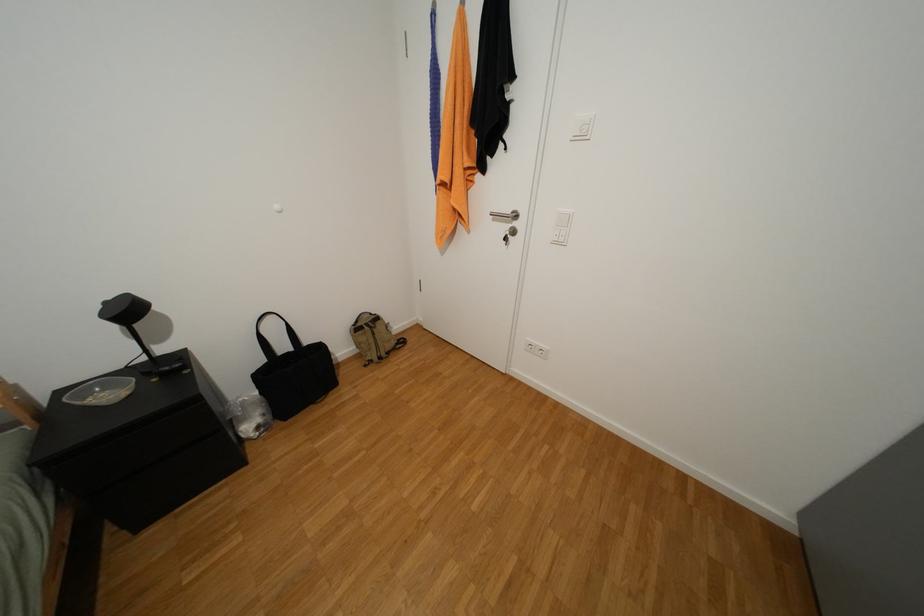
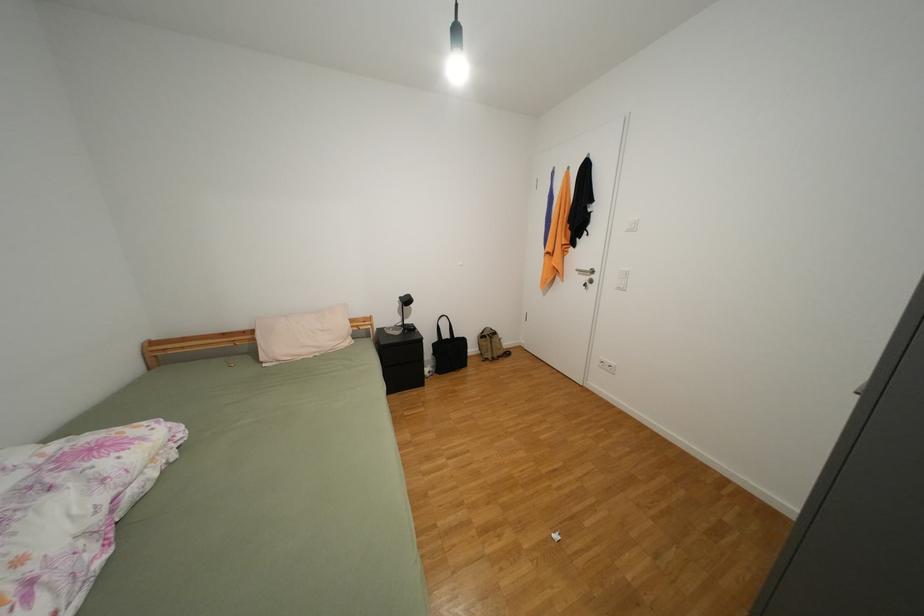
Question: What movement of the cameraman would produce the second image?

Choices:
 (A) Left
 (B) Right
 (C) Forward
 (D) Backward

Answer: (D)